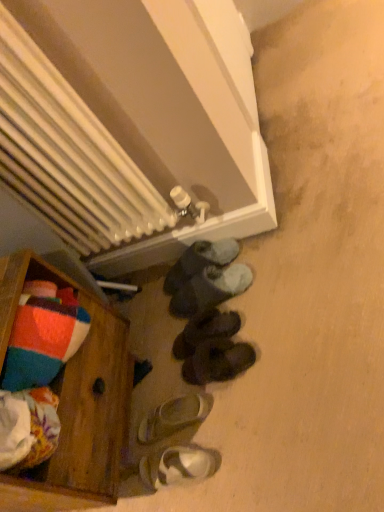
Question: From the image's perspective, relative to black suede slippers at center, which is counted as the third footwear, starting from the top, is wooden chest at lower left above or below?

Choices:
 (A) above
 (B) below

Answer: (B)

Question: Is wooden chest at lower left inside or outside of black suede slippers at center, which is counted as the third footwear, starting from the top?

Choices:
 (A) inside
 (B) outside

Answer: (B)

Question: Which is farther from the dark gray suede slippers at lower center, which is the 5th footwear from bottom to top?

Choices:
 (A) black suede slippers at center, which is counted as the third footwear, starting from the top
 (B) black suede shoes at lower center, which is the 4th footwear in top-to-bottom order
 (C) wooden chest at lower left
 (D) blue fuzzy slippers at center, the sixth footwear positioned from the bottom
 (E) white matte sandal at lower center, which is the fifth footwear from top to bottom

Answer: (C)

Question: Considering the real-world distances, which object is farthest from the dark gray suede slippers at lower center, the second footwear positioned from the top?

Choices:
 (A) white metallic radiator at upper center
 (B) wooden chest at lower left
 (C) white matte sandals at lower center, placed as the sixth footwear when sorted from top to bottom
 (D) white matte sandal at lower center, which is the fifth footwear from top to bottom
 (E) black suede slippers at center, which is counted as the third footwear, starting from the top

Answer: (C)